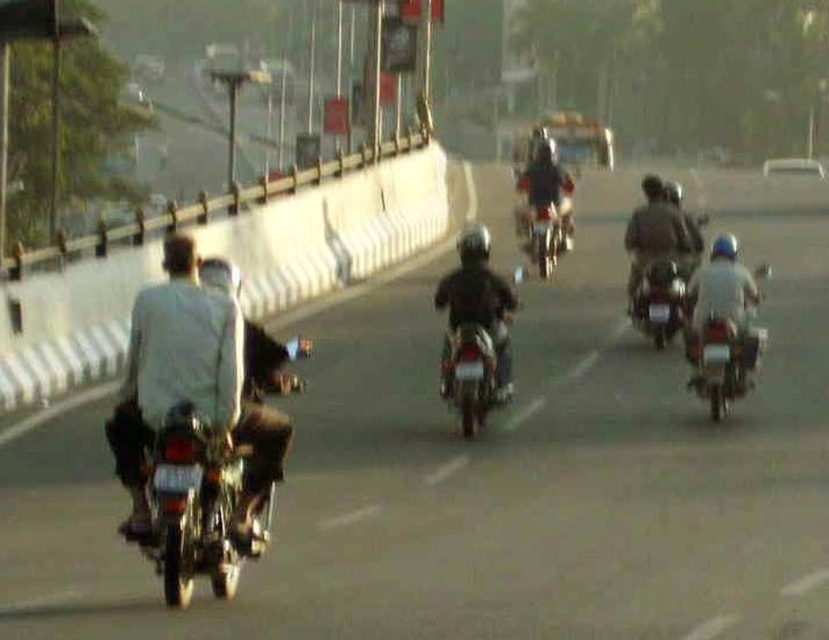
Who is more forward, (745,308) or (537,208)?

Point (745,308) is in front.

Does metallic silver motorcycle at right have a larger size compared to shiny chrome motorcycle at center?

Correct, metallic silver motorcycle at right is larger in size than shiny chrome motorcycle at center.

The width and height of the screenshot is (829, 640). What do you see at coordinates (721, 332) in the screenshot? I see `metallic silver motorcycle at right` at bounding box center [721, 332].

Locate an element on the screen. metallic silver motorcycle at right is located at coordinates (721, 332).

Is metallic silver motorcycle at right bigger than dark brown leather jacket at center?

No.

Who is more forward, (728,381) or (668,230)?

Positioned in front is point (728,381).

Who is more forward, (752, 291) or (676, 232)?

Point (752, 291) is more forward.

Identify the location of metallic silver motorcycle at right. The width and height of the screenshot is (829, 640). (721, 332).

Between light gray fabric shirt at left and metallic silver motorcycle at center-right, which one has more height?

light gray fabric shirt at left

Where is `light gray fabric shirt at left`? Image resolution: width=829 pixels, height=640 pixels. light gray fabric shirt at left is located at coordinates (175, 368).

Identify the location of light gray fabric shirt at left. (175, 368).